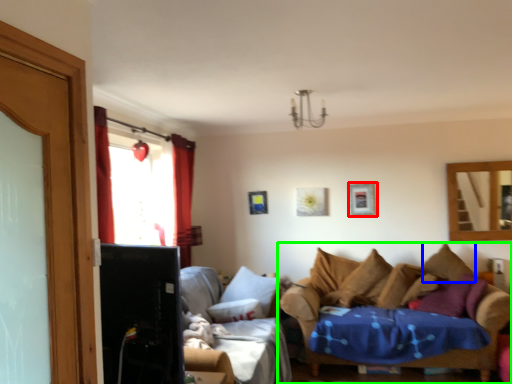
Question: Which object is positioned closest to picture frame (highlighted by a red box)? Select from pillow (highlighted by a blue box) and studio couch (highlighted by a green box).

Choices:
 (A) pillow
 (B) studio couch

Answer: (B)